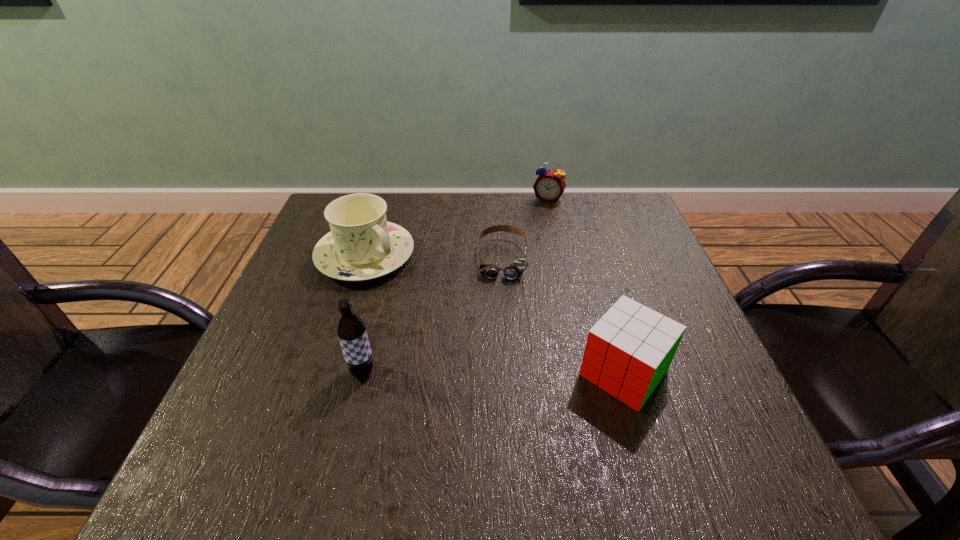
Select which object is the second closest to the cube. Please provide its 2D coordinates. Your answer should be formatted as a tuple, i.e. [(x, y)], where the tuple contains the x and y coordinates of a point satisfying the conditions above.

[(362, 245)]

Identify which object is the second nearest to the chinaware. Please provide its 2D coordinates. Your answer should be formatted as a tuple, i.e. [(x, y)], where the tuple contains the x and y coordinates of a point satisfying the conditions above.

[(351, 330)]

I want to click on free location that satisfies the following two spatial constraints: 1. on the front side of the cube; 2. on the right side of the farthest object, so click(x=586, y=373).

Locate an element on the screen. free spot that satisfies the following two spatial constraints: 1. on the back side of the farthest object; 2. on the right side of the tallest object is located at coordinates (x=405, y=199).

Where is `blank space that satisfies the following two spatial constraints: 1. on the front side of the third object from left to right; 2. on the right side of the chinaware`? The image size is (960, 540). blank space that satisfies the following two spatial constraints: 1. on the front side of the third object from left to right; 2. on the right side of the chinaware is located at coordinates (365, 258).